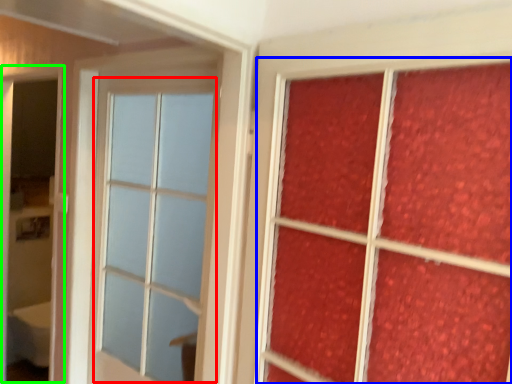
Question: Estimate the real-world distances between objects in this image. Which object is farther from glass window (highlighted by a red box), bay window (highlighted by a blue box) or screen door (highlighted by a green box)?

Choices:
 (A) bay window
 (B) screen door

Answer: (A)